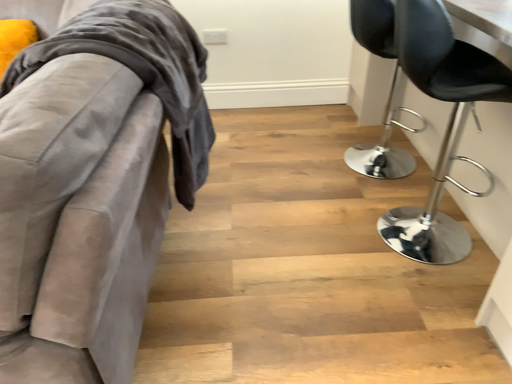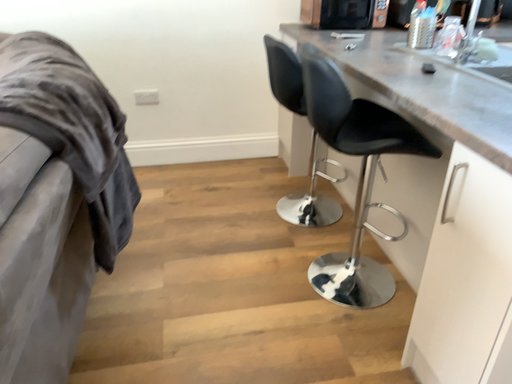
Question: How did the camera likely rotate when shooting the video?

Choices:
 (A) rotated downward
 (B) rotated upward

Answer: (B)